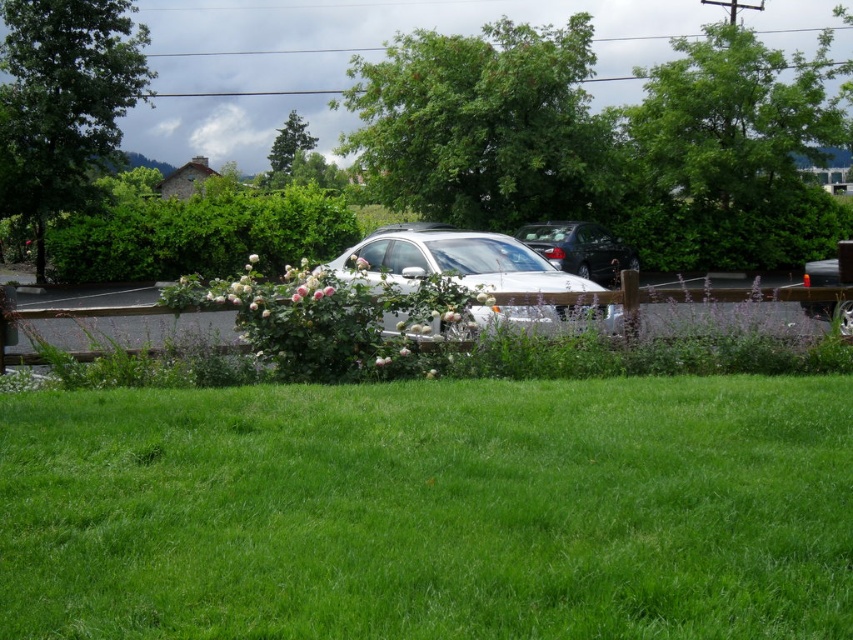
Question: Can you confirm if green leafy tree at upper center is positioned above green textured tree at upper center?

Choices:
 (A) no
 (B) yes

Answer: (B)

Question: Which of the following is the closest to the observer?

Choices:
 (A) green leafy tree at upper left
 (B) green textured tree at upper center
 (C) green grassy field at lower center

Answer: (C)

Question: Considering the real-world distances, which object is closest to the green grassy field at lower center?

Choices:
 (A) green leafy tree at upper center
 (B) satin black sedan at center
 (C) green leafy tree at upper left

Answer: (B)

Question: Is green grassy field at lower center behind green textured tree at upper center?

Choices:
 (A) yes
 (B) no

Answer: (B)

Question: Which point appears closest to the camera in this image?

Choices:
 (A) (515, 120)
 (B) (111, 13)

Answer: (A)

Question: Can you confirm if green leafy tree at upper center is thinner than satin black sedan at center?

Choices:
 (A) yes
 (B) no

Answer: (B)